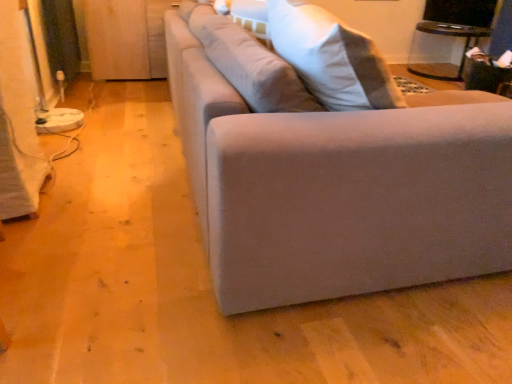
Locate an element on the screen. The image size is (512, 384). wooden at left is located at coordinates (126, 38).

From the image's perspective, who appears lower, suede-like beige couch at center or wooden at left?

suede-like beige couch at center.

Does suede-like beige couch at center turn towards wooden at left?

No, suede-like beige couch at center is not aimed at wooden at left.

Would you consider suede-like beige couch at center to be distant from wooden at left?

Yes, suede-like beige couch at center is far from wooden at left.

From a real-world perspective, is suede-like beige couch at center positioned above or below wooden at left?

suede-like beige couch at center is above wooden at left.

Which object is further away from the camera, transparent glass table at upper right or suede-like beige couch at center?

transparent glass table at upper right is further from the camera.

Which point is more forward, [437,31] or [471,168]?

The point [471,168] is in front.

Is transparent glass table at upper right located outside suede-like beige couch at center?

Yes, transparent glass table at upper right is not within suede-like beige couch at center.

Based on the photo, from a real-world perspective, which object rests below the other?

transparent glass table at upper right is physically lower.

Which object is positioned more to the left, transparent glass table at upper right or wooden at left?

From the viewer's perspective, wooden at left appears more on the left side.

Considering the sizes of objects transparent glass table at upper right and wooden at left in the image provided, who is shorter, transparent glass table at upper right or wooden at left?

transparent glass table at upper right.

The width and height of the screenshot is (512, 384). I want to click on dresser positioned vertically above the transparent glass table at upper right (from a real-world perspective), so click(126, 38).

How many degrees apart are the facing directions of transparent glass table at upper right and wooden at left?

There is a 66-degree angle between the facing directions of transparent glass table at upper right and wooden at left.

Is suede-like beige couch at center next to transparent glass table at upper right and touching it?

No, suede-like beige couch at center is not next to transparent glass table at upper right.

Measure the distance from suede-like beige couch at center to transparent glass table at upper right.

suede-like beige couch at center is 11.18 feet away from transparent glass table at upper right.

Considering the sizes of objects suede-like beige couch at center and transparent glass table at upper right in the image provided, who is wider, suede-like beige couch at center or transparent glass table at upper right?

Wider between the two is suede-like beige couch at center.

Does point (312, 149) appear closer or farther from the camera than point (412, 64)?

Point (312, 149) appears to be closer to the viewer than point (412, 64).

Considering the sizes of objects wooden at left and suede-like beige couch at center in the image provided, who is taller, wooden at left or suede-like beige couch at center?

suede-like beige couch at center.

Based on their sizes in the image, would you say wooden at left is bigger or smaller than suede-like beige couch at center?

Clearly, wooden at left is smaller in size than suede-like beige couch at center.

Is point (103, 75) positioned behind point (291, 198)?

Yes.

Does point (138, 39) appear closer or farther from the camera than point (412, 71)?

Clearly, point (138, 39) is closer to the camera than point (412, 71).

Which of these two, wooden at left or transparent glass table at upper right, is thinner?

With smaller width is wooden at left.

From the picture: Is wooden at left bigger than transparent glass table at upper right?

Indeed, wooden at left has a larger size compared to transparent glass table at upper right.

From a real-world perspective, who is located lower, wooden at left or transparent glass table at upper right?

transparent glass table at upper right.

At what (x,y) coordinates should I click in order to perform the action: click on studio couch above the wooden at left (from a real-world perspective). Please return your answer as a coordinate pair (x, y). Looking at the image, I should click on (335, 183).

You are a GUI agent. You are given a task and a screenshot of the screen. Output one action in this format:
    pyautogui.click(x=<x>, y=<y>)
    Task: Click on the table that appears on the right of suede-like beige couch at center
    This screenshot has height=384, width=512.
    Given the screenshot: What is the action you would take?
    pyautogui.click(x=450, y=36)

When comparing their distances from transparent glass table at upper right, does wooden at left or suede-like beige couch at center seem further?

suede-like beige couch at center is further to transparent glass table at upper right.

Based on their spatial positions, is transparent glass table at upper right or wooden at left further from suede-like beige couch at center?

Among the two, transparent glass table at upper right is located further to suede-like beige couch at center.

Based on their spatial positions, is suede-like beige couch at center or transparent glass table at upper right closer to wooden at left?

suede-like beige couch at center.

From the image, which object appears to be nearer to suede-like beige couch at center, wooden at left or transparent glass table at upper right?

wooden at left lies closer to suede-like beige couch at center than the other object.

Looking at the image, which one is located closer to wooden at left, transparent glass table at upper right or suede-like beige couch at center?

suede-like beige couch at center.

Estimate the real-world distances between objects in this image. Which object is further from transparent glass table at upper right, suede-like beige couch at center or wooden at left?

Among the two, suede-like beige couch at center is located further to transparent glass table at upper right.

Identify the location of dresser between suede-like beige couch at center and transparent glass table at upper right in the front-back direction. (126, 38).